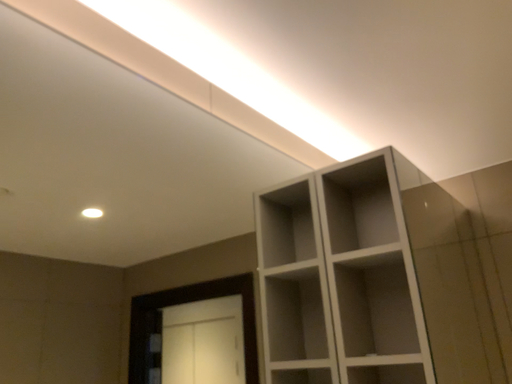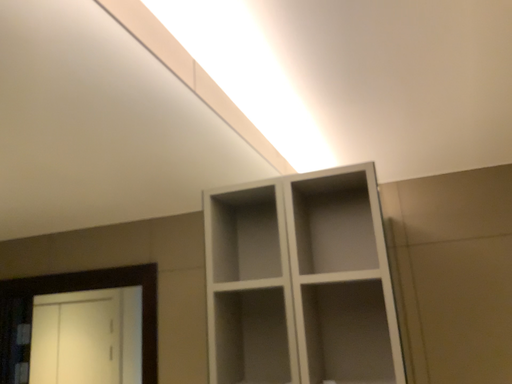
Question: Which way did the camera rotate in the video?

Choices:
 (A) rotated right
 (B) rotated left

Answer: (A)